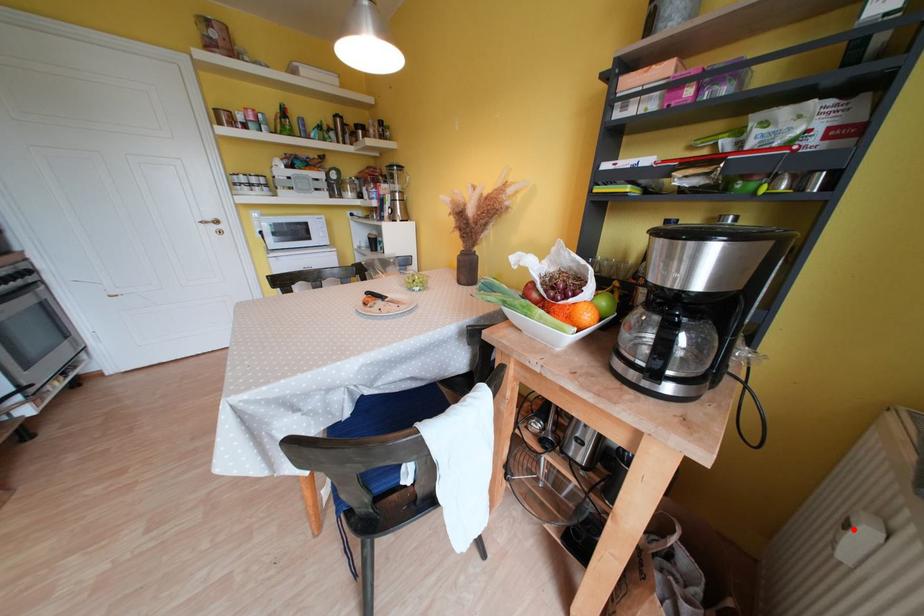
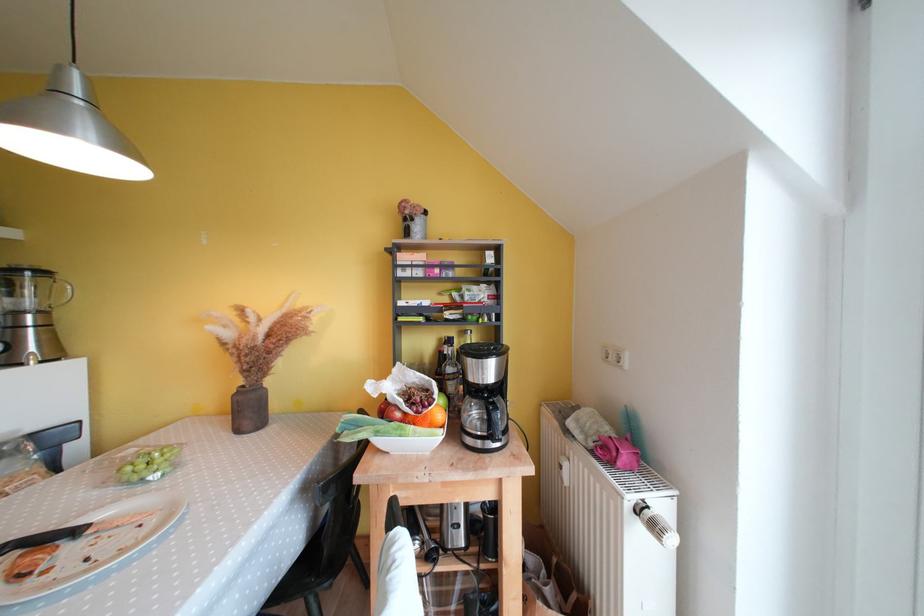
In the second image, find the point that corresponds to the highlighted location in the first image.

(566, 471)